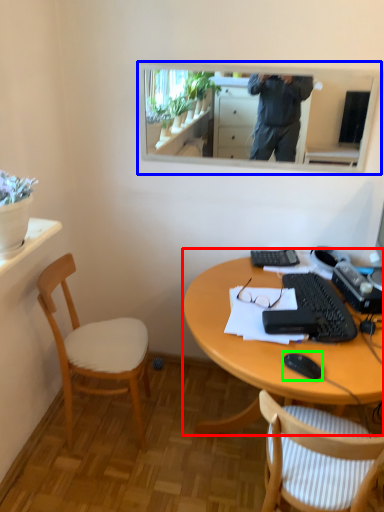
Question: Which is nearer to the desk (highlighted by a red box)? mirror (highlighted by a blue box) or mouse (highlighted by a green box).

Choices:
 (A) mirror
 (B) mouse

Answer: (B)